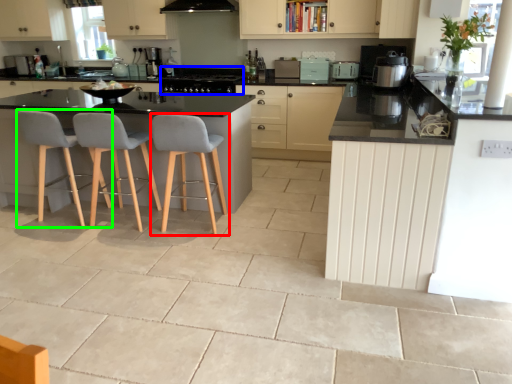
Question: Which object is the farthest from chair (highlighted by a red box)? Choose among these: appliance (highlighted by a blue box) or chair (highlighted by a green box).

Choices:
 (A) appliance
 (B) chair

Answer: (A)